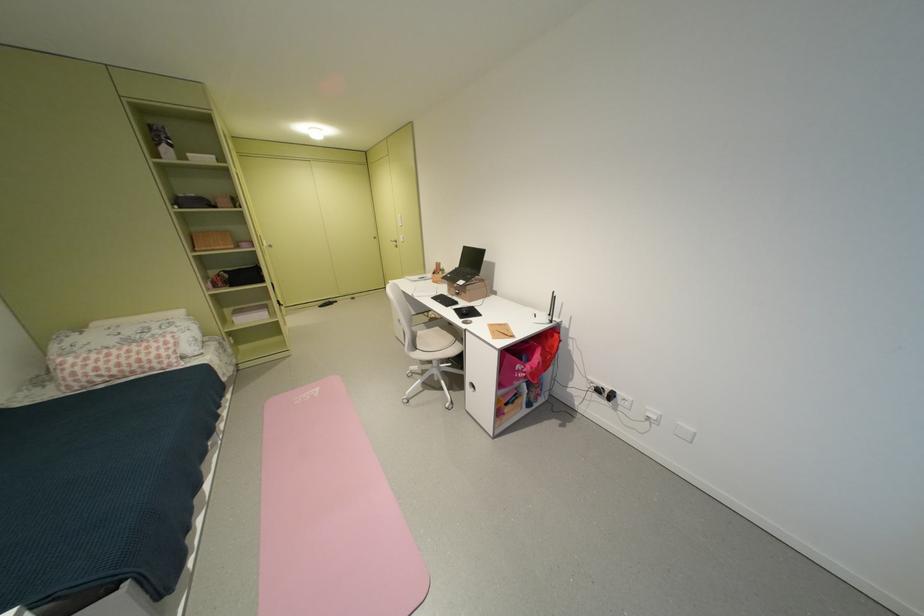
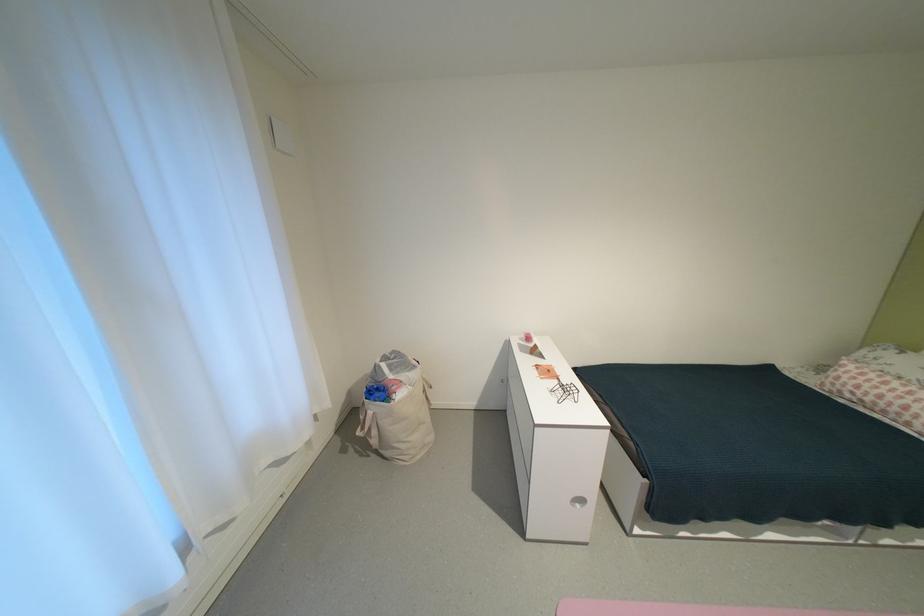
Locate, in the second image, the point that corresponds to point 111,374 in the first image.

(867, 392)